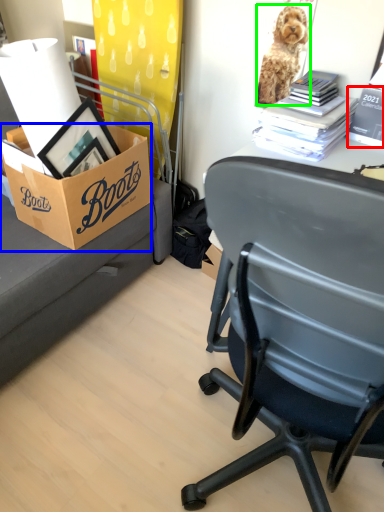
Question: Based on their relative distances, which object is nearer to book (highlighted by a red box)? Choose from box (highlighted by a blue box) and dog (highlighted by a green box).

Choices:
 (A) box
 (B) dog

Answer: (B)